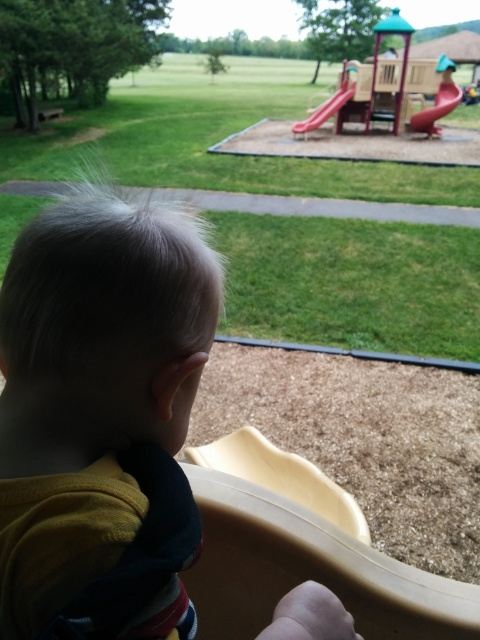
You are a parent trying to locate your child who is wearing a yellow cotton shirt at lower left. You see the smooth red slide at upper right in the distance. Which direction should you walk to find your child?

The yellow cotton shirt at lower left is to the left of the smooth red slide at upper right, so you should walk to the left to find your child.

You are a parent standing next to the yellow cotton shirt at lower left and want to ensure your child can safely reach the smooth plastic slide at center. Given that your child can walk 15 meters without assistance, will they need help to reach the slide?

The distance between the yellow cotton shirt at lower left and the smooth plastic slide at center is 16.40 meters. Since the child can walk 15 meters without assistance, they will need help for the remaining 1.40 meters to reach the slide.

You are a parent trying to decide which play equipment to let your child play on first. You see the yellow cotton shirt at lower left and the smooth red slide at upper right. Which one is bigger?

The smooth red slide at upper right is bigger than the yellow cotton shirt at lower left.